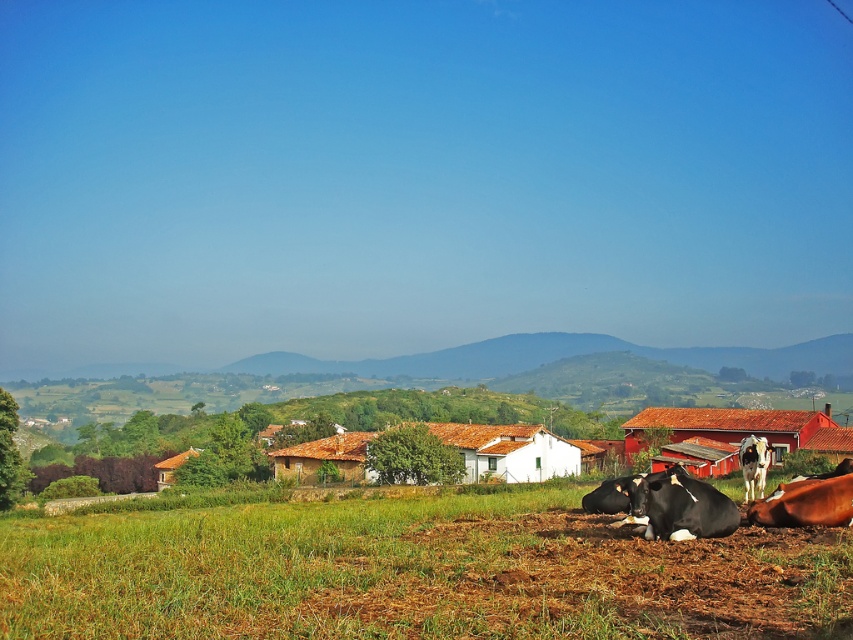
You are a photographer standing in the field and want to capture both the green grass at lower left and the black glossy cow at lower center in the same frame. Which object should you focus on first to ensure both are in the frame?

The green grass at lower left is wider than the black glossy cow at lower center, so focusing on the green grass at lower left first would help ensure both are within the frame.